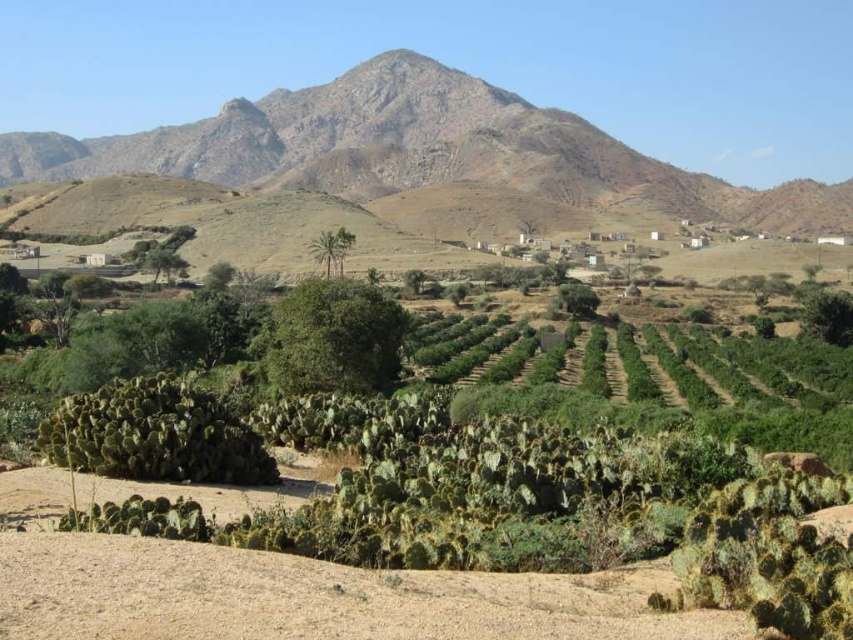
Between point (244, 536) and point (518, 164), which one is positioned in front?

Point (244, 536)

Is point (527, 557) positioned after point (630, 180)?

That is False.

Where is `green spiny cactus at center`? The height and width of the screenshot is (640, 853). green spiny cactus at center is located at coordinates (543, 499).